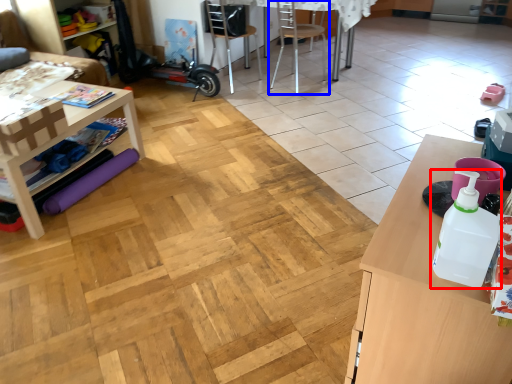
Question: Which object is further to the camera taking this photo, bottle (highlighted by a red box) or chair (highlighted by a blue box)?

Choices:
 (A) bottle
 (B) chair

Answer: (B)